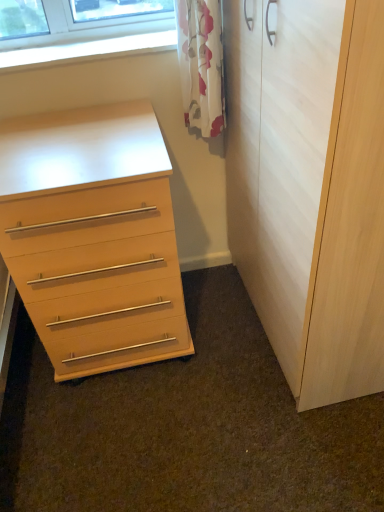
You are a GUI agent. You are given a task and a screenshot of the screen. Output one action in this format:
    pyautogui.click(x=<x>, y=<y>)
    Task: Click on the free space above clear glass window at upper left (from a real-world perspective)
    The image size is (384, 512).
    Given the screenshot: What is the action you would take?
    pyautogui.click(x=102, y=44)